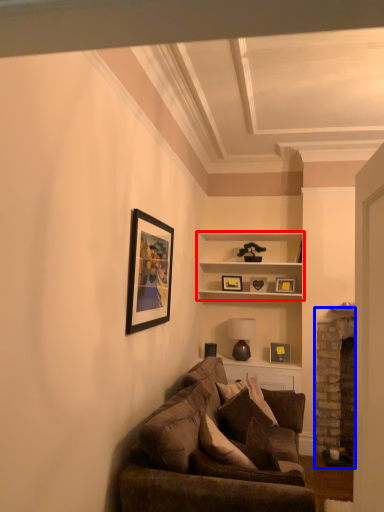
Question: Which of the following is the farthest to the observer, shelf (highlighted by a red box) or fireplace (highlighted by a blue box)?

Choices:
 (A) shelf
 (B) fireplace

Answer: (A)